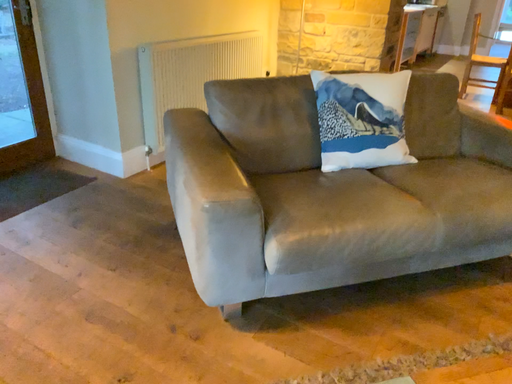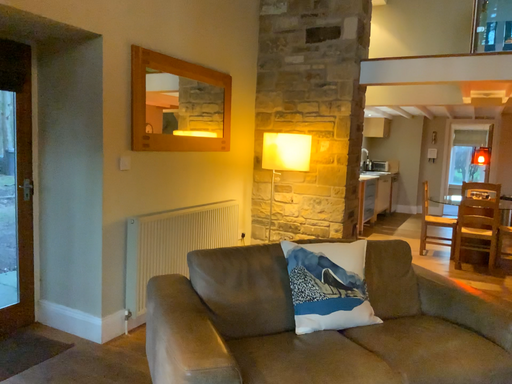
Question: Which way did the camera rotate in the video?

Choices:
 (A) rotated upward
 (B) rotated downward

Answer: (A)